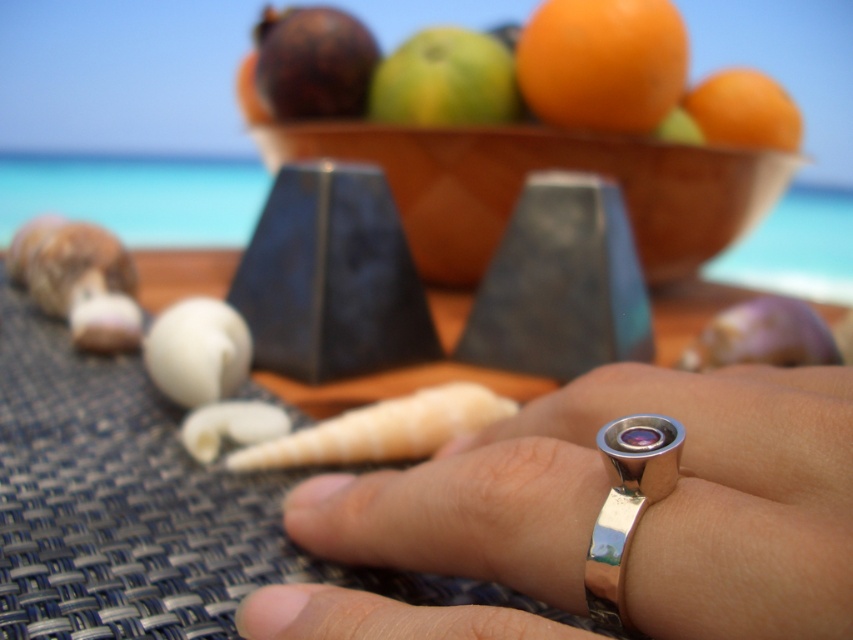
Question: Among these objects, which one is farthest from the camera?

Choices:
 (A) shiny brown coconut at upper center
 (B) green matte apple at upper center
 (C) polished silver ring at center
 (D) woven plastic table at center

Answer: (A)

Question: Among these objects, which one is farthest from the camera?

Choices:
 (A) woven plastic table at center
 (B) green matte apple at upper center

Answer: (B)

Question: Can you confirm if orangesmoothfruit at upper center is positioned to the left of polished silver ring at center?

Choices:
 (A) no
 (B) yes

Answer: (A)

Question: Can you confirm if green matte apple at upper center is positioned above orangesmoothfruit at right?

Choices:
 (A) yes
 (B) no

Answer: (A)

Question: Which object is positioned closest to the polished silver ring at center?

Choices:
 (A) orangesmoothfruit at upper center
 (B) shiny brown coconut at upper center
 (C) green matte apple at upper center

Answer: (A)

Question: Is woven plastic table at center above green matte apple at upper center?

Choices:
 (A) no
 (B) yes

Answer: (A)